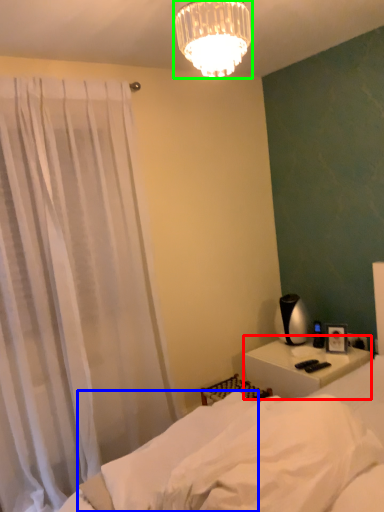
Question: Estimate the real-world distances between objects in this image. Which object is farther from nightstand (highlighted by a red box), sheet (highlighted by a blue box) or lamp (highlighted by a green box)?

Choices:
 (A) sheet
 (B) lamp

Answer: (B)